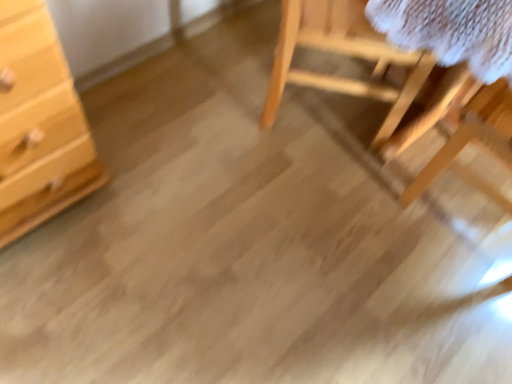
Locate an element on the screen. The height and width of the screenshot is (384, 512). vacant area that is situated to the right of light wood chest of drawers at left is located at coordinates (146, 208).